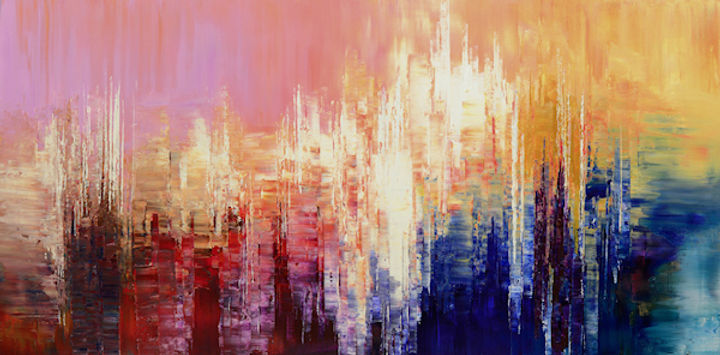
At what (x,y) coordinates should I click in order to perform the action: click on painting. Please return your answer as a coordinate pair (x, y). Image resolution: width=720 pixels, height=355 pixels. Looking at the image, I should click on (476, 114).